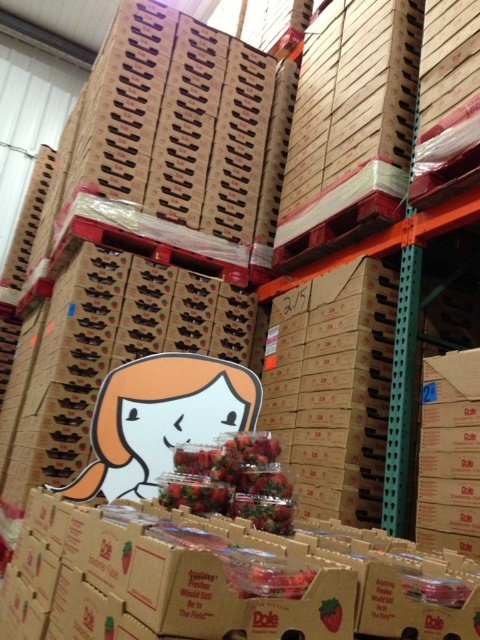
You are a warehouse worker who needs to inspect the strawberries. You have to choose between the shiny red strawberries at center and the smooth red strawberry at center. Which one is easier to reach?

The shiny red strawberries at center are easier to reach because the smooth red strawberry at center is behind them.

You are a warehouse worker who needs to pick up the shiny red strawberries at center. The safety protocol requires that you maintain a minimum distance of 36 inches from any object to avoid collision with the forklift. Can you safely pick up the strawberries without violating the safety protocol?

The shiny red strawberries at center is 36.70 inches away from viewer, which is slightly more than the required 36 inches. Therefore, you can safely pick up the strawberries without violating the safety protocol.